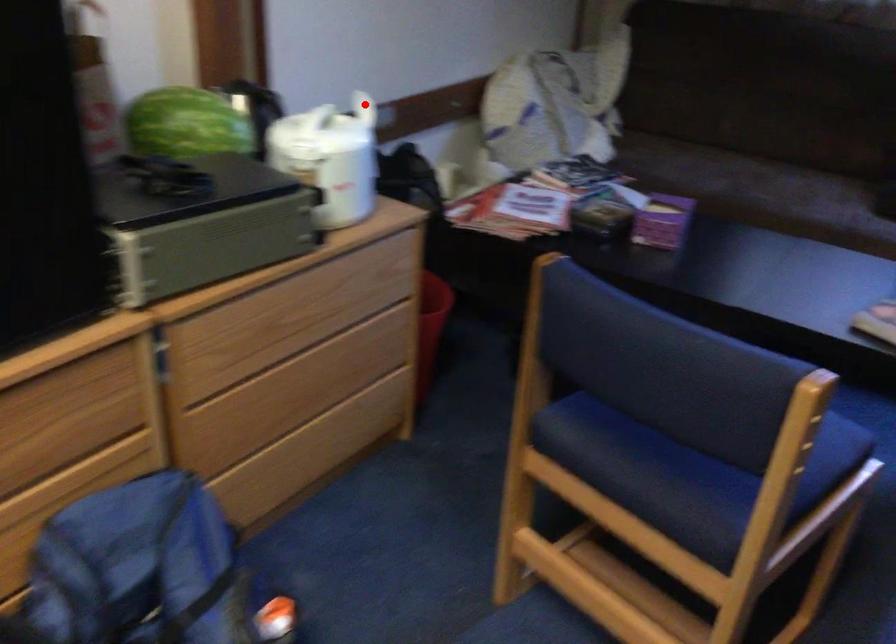
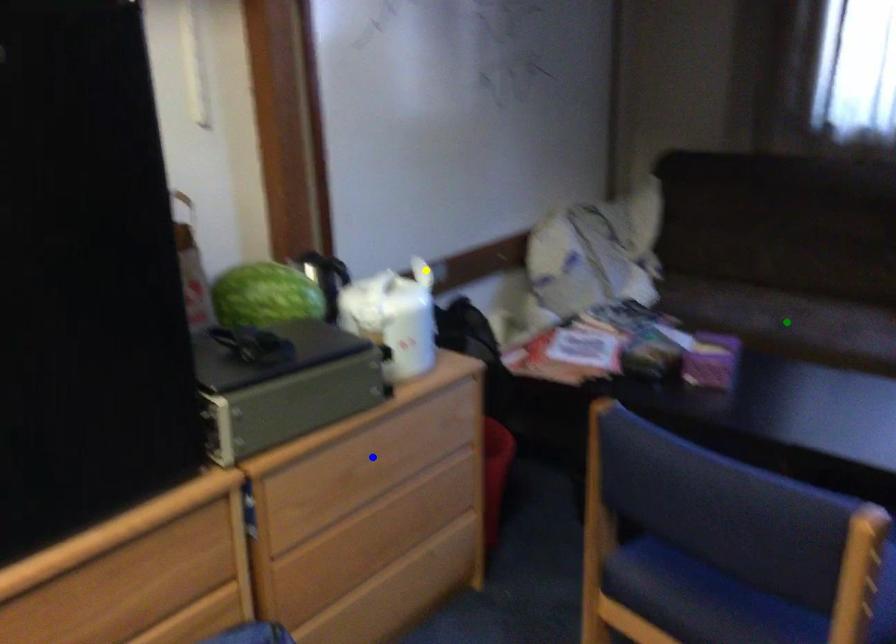
Question: I am providing you with two images of the same scene from different viewpoints. A red point is marked on the first image. You are given multiple points on the second image. Which mark in image 2 goes with the point in image 1?

Choices:
 (A) green point
 (B) yellow point
 (C) blue point

Answer: (B)